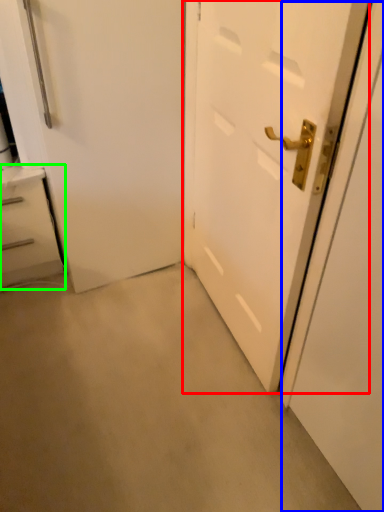
Question: Considering the real-world distances, which object is closest to door (highlighted by a red box)? screen door (highlighted by a blue box) or chest of drawers (highlighted by a green box).

Choices:
 (A) screen door
 (B) chest of drawers

Answer: (A)